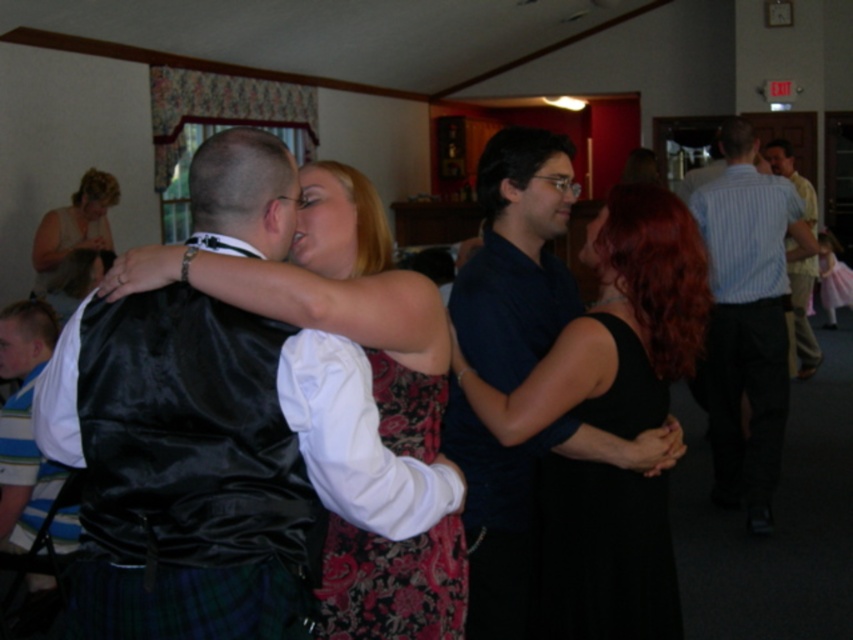
Is black satin dress at center thinner than floral satin dress at center?

In fact, black satin dress at center might be wider than floral satin dress at center.

Does point (634, 353) come farther from viewer compared to point (328, 627)?

Yes.

At what (x,y) coordinates should I click in order to perform the action: click on black satin dress at center. Please return your answer as a coordinate pair (x, y). The image size is (853, 640). Looking at the image, I should click on (601, 554).

From the picture: Is black satin dress at center taller than striped shirt at right?

No.

Who is more distant from viewer, (541, 572) or (807, 186)?

The point (807, 186) is more distant.

At what (x,y) coordinates should I click in order to perform the action: click on black satin dress at center. Please return your answer as a coordinate pair (x, y). This screenshot has height=640, width=853. Looking at the image, I should click on (601, 554).

Can you confirm if shiny black vest at center is positioned above shiny black dress at center?

Yes, shiny black vest at center is above shiny black dress at center.

Consider the image. Is shiny black vest at center shorter than shiny black dress at center?

Correct, shiny black vest at center is not as tall as shiny black dress at center.

Who is more distant from viewer, (231, 140) or (686, 352)?

Point (686, 352)

The width and height of the screenshot is (853, 640). Find the location of `shiny black vest at center`. shiny black vest at center is located at coordinates (216, 465).